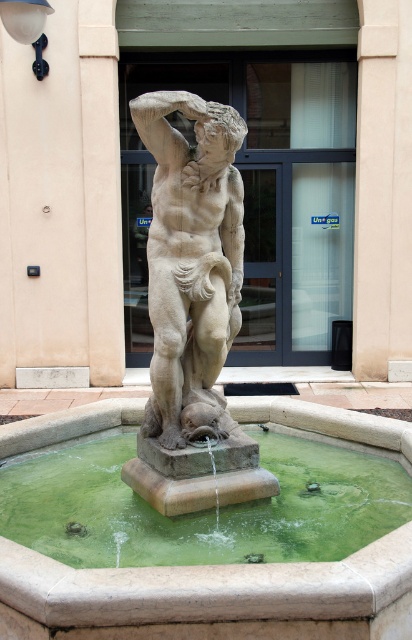
You are standing in front of the fountain and want to place a small flower pot between the green stone water at center and the stone statue at center. Can you fit it there?

The green stone water at center is wider than the stone statue at center, so there is enough space to place a small flower pot between them.

You are standing in front of the fountain and want to pour a drink into the green stone water at center without getting your beige stone pillar at upper center wet. Is this possible?

The green stone water at center is below the beige stone pillar at upper center, so pouring the drink into the water won based on the position, so the pillar won not get wet.